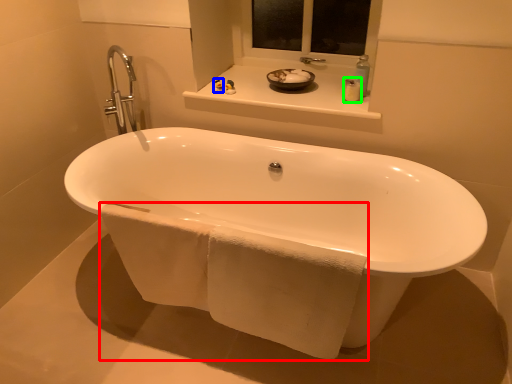
Question: Considering the real-world distances, which object is closest to bath towel (highlighted by a red box)? toiletry (highlighted by a blue box) or toiletry (highlighted by a green box).

Choices:
 (A) toiletry
 (B) toiletry

Answer: (B)